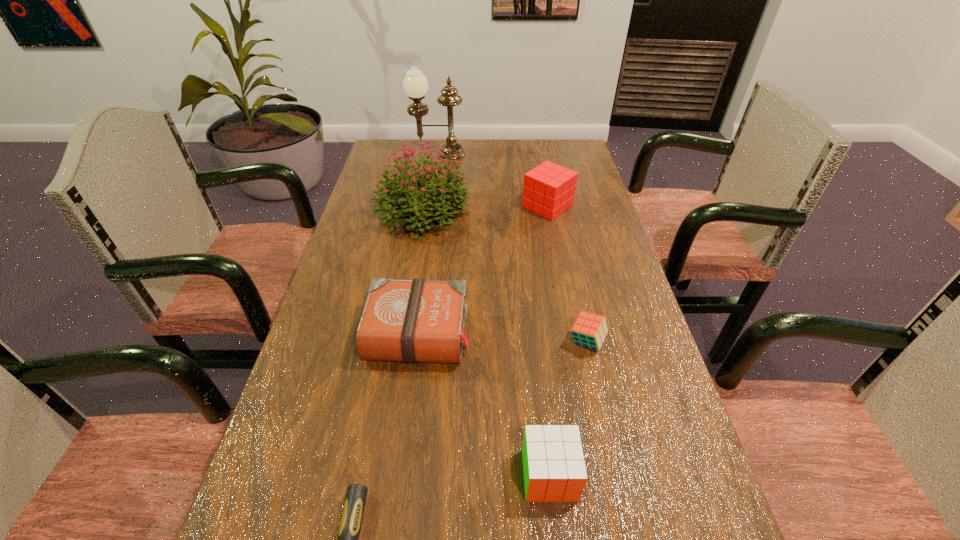
This screenshot has width=960, height=540. Find the location of `vacant space situated 0.050m on the back of the sixth shortest object`. vacant space situated 0.050m on the back of the sixth shortest object is located at coordinates (429, 178).

I want to click on free space located on the front of the fifth shortest object, so click(x=553, y=235).

Identify the location of vacant space located 0.250m on the right of the Bible. (581, 330).

Where is `vacant area located 0.160m on the left of the nearest cube`? This screenshot has width=960, height=540. vacant area located 0.160m on the left of the nearest cube is located at coordinates (431, 475).

You are a GUI agent. You are given a task and a screenshot of the screen. Output one action in this format:
    pyautogui.click(x=<x>, y=<y>)
    Task: Click on the vacant space located on the back of the sixth tallest object
    This screenshot has height=540, width=960.
    Given the screenshot: What is the action you would take?
    pyautogui.click(x=565, y=246)

At what (x,y) coordinates should I click in order to perform the action: click on object located at the far edge. Please return your answer as a coordinate pair (x, y). The height and width of the screenshot is (540, 960). Looking at the image, I should click on (415, 84).

Where is `oil lamp at the left edge`? oil lamp at the left edge is located at coordinates (415, 84).

The image size is (960, 540). Identify the location of bouquet situated at the left edge. (435, 181).

Find the location of a particular element. The height and width of the screenshot is (540, 960). Bible that is at the left edge is located at coordinates (411, 321).

Find the location of a particular element. object that is at the far left corner is located at coordinates (415, 84).